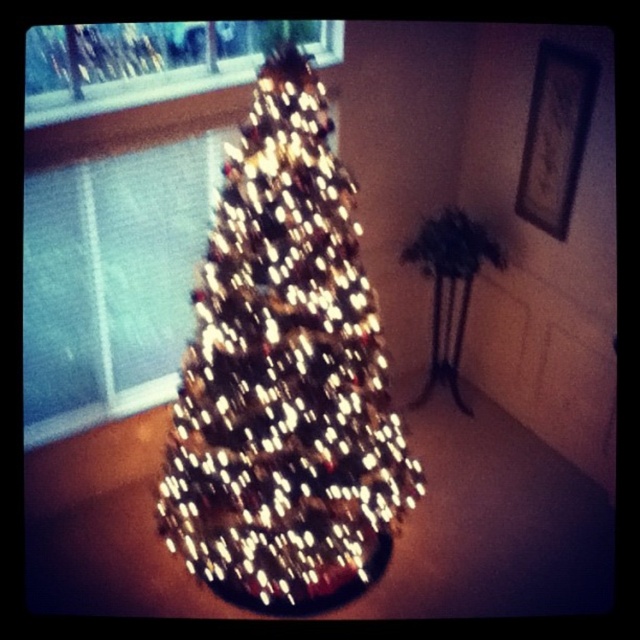
Question: Can you confirm if iridescent glass christmas tree at center is positioned to the right of transparent glass window at upper left?

Choices:
 (A) yes
 (B) no

Answer: (A)

Question: Which object appears closest to the camera in this image?

Choices:
 (A) transparent glass window at upper left
 (B) iridescent glass christmas tree at center

Answer: (B)

Question: Does iridescent glass christmas tree at center have a smaller size compared to transparent glass window at upper left?

Choices:
 (A) no
 (B) yes

Answer: (A)

Question: Is iridescent glass christmas tree at center smaller than transparent glass window at upper left?

Choices:
 (A) yes
 (B) no

Answer: (B)

Question: Which object appears closest to the camera in this image?

Choices:
 (A) transparent glass window at upper left
 (B) iridescent glass christmas tree at center

Answer: (B)

Question: Which point is farther to the camera?

Choices:
 (A) pos(218,262)
 (B) pos(147,353)

Answer: (B)